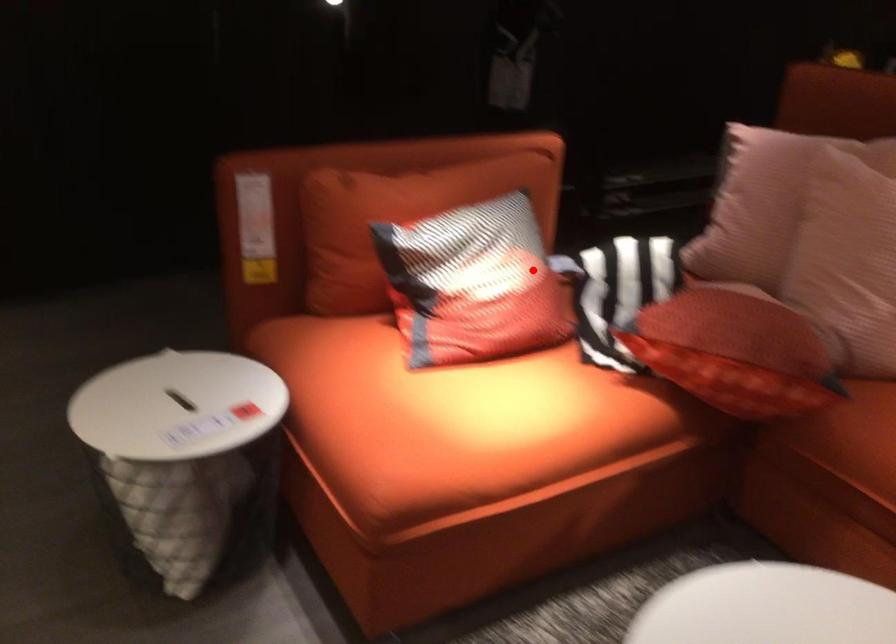
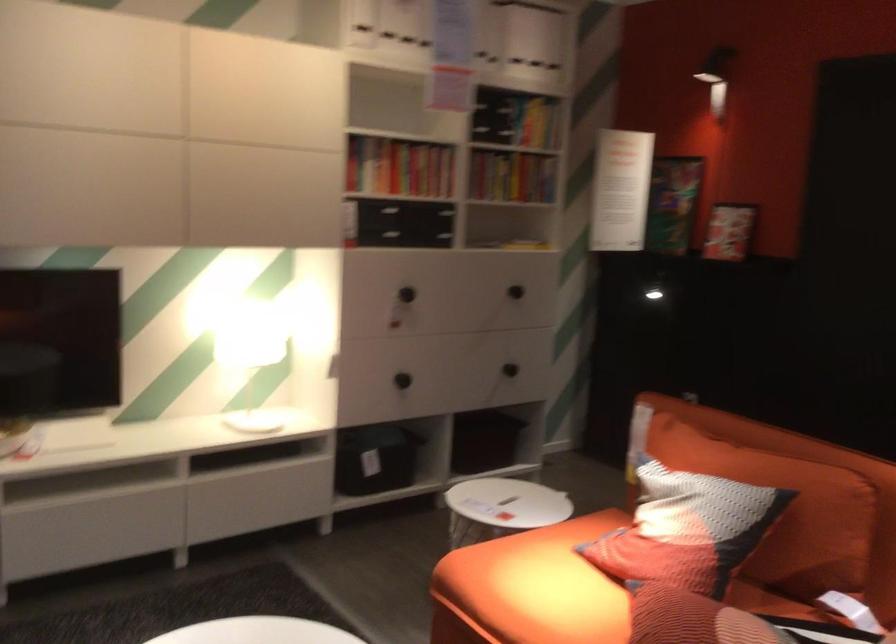
The point at the highlighted location is marked in the first image. Where is the corresponding point in the second image?

(686, 529)